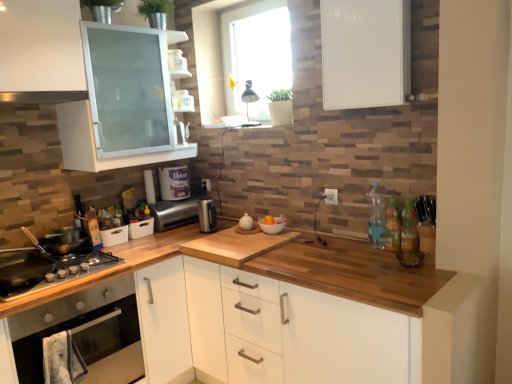
Question: From a real-world perspective, is clear plastic bottle at right, which is counted as the 3th bottle, starting from the right, physically above satin silver exhaust hood at upper left?

Choices:
 (A) yes
 (B) no

Answer: (B)

Question: From a real-world perspective, is clear plastic bottle at right, placed as the first bottle when sorted from left to right, located beneath satin silver exhaust hood at upper left?

Choices:
 (A) yes
 (B) no

Answer: (A)

Question: From the image's perspective, would you say clear plastic bottle at right, which is counted as the 3th bottle, starting from the right, is positioned over satin silver exhaust hood at upper left?

Choices:
 (A) no
 (B) yes

Answer: (A)

Question: Can you confirm if clear plastic bottle at right, placed as the first bottle when sorted from left to right, is bigger than satin silver exhaust hood at upper left?

Choices:
 (A) yes
 (B) no

Answer: (B)

Question: Does clear plastic bottle at right, placed as the first bottle when sorted from left to right, have a greater width compared to satin silver exhaust hood at upper left?

Choices:
 (A) no
 (B) yes

Answer: (A)

Question: Do you think wooden countertop at center, which ranks as the first cabinetry in bottom-to-top order, is within satin silver exhaust hood at upper left, or outside of it?

Choices:
 (A) outside
 (B) inside

Answer: (A)

Question: From the image's perspective, is wooden countertop at center, which ranks as the first cabinetry in bottom-to-top order, above or below satin silver exhaust hood at upper left?

Choices:
 (A) below
 (B) above

Answer: (A)

Question: Visually, is wooden countertop at center, which ranks as the first cabinetry in bottom-to-top order, positioned to the left or to the right of satin silver exhaust hood at upper left?

Choices:
 (A) left
 (B) right

Answer: (B)

Question: Considering the positions of wooden countertop at center, which ranks as the first cabinetry in bottom-to-top order, and satin silver exhaust hood at upper left in the image, is wooden countertop at center, which ranks as the first cabinetry in bottom-to-top order, taller or shorter than satin silver exhaust hood at upper left?

Choices:
 (A) short
 (B) tall

Answer: (B)

Question: Choose the correct answer: Is stainless steel oven at lower left inside wooden countertop at center, the second cabinetry from the top, or outside it?

Choices:
 (A) inside
 (B) outside

Answer: (B)

Question: Is stainless steel oven at lower left bigger or smaller than wooden countertop at center, which ranks as the first cabinetry in bottom-to-top order?

Choices:
 (A) small
 (B) big

Answer: (A)

Question: Considering their positions, is stainless steel oven at lower left located in front of or behind wooden countertop at center, which ranks as the first cabinetry in bottom-to-top order?

Choices:
 (A) front
 (B) behind

Answer: (B)

Question: From the image's perspective, is stainless steel oven at lower left above or below wooden countertop at center, the second cabinetry from the top?

Choices:
 (A) below
 (B) above

Answer: (B)

Question: Is clear plastic bottle at right, placed as the first bottle when sorted from left to right, wider or thinner than translucent plastic bottles at right, arranged as the 3th bottle when viewed from the left?

Choices:
 (A) wide
 (B) thin

Answer: (A)

Question: Relative to translucent plastic bottles at right, which is counted as the first bottle, starting from the right, is clear plastic bottle at right, which is counted as the 3th bottle, starting from the right, in front or behind?

Choices:
 (A) behind
 (B) front

Answer: (A)